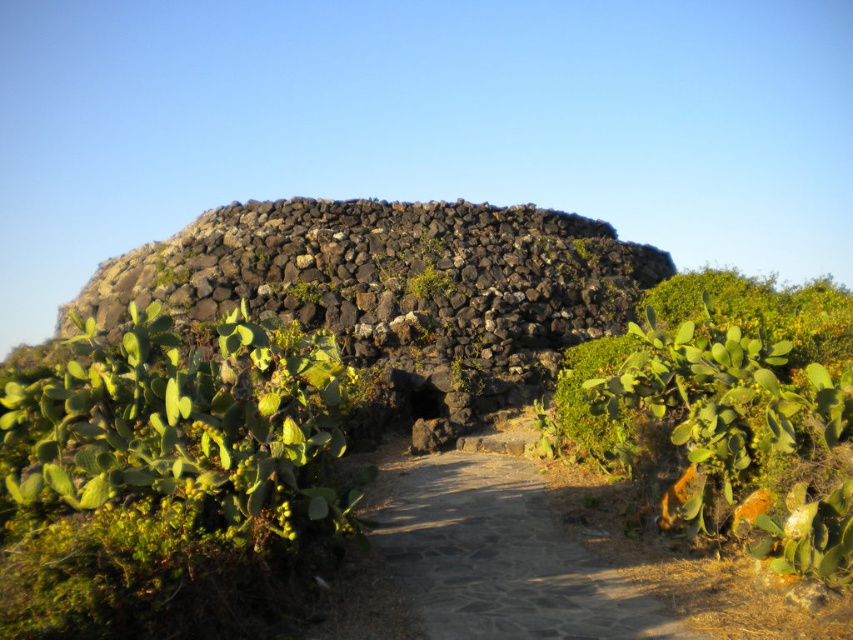
You are standing on the paved pathway leading to the ancient stone structure. You notice a volcanic rock at center and a green mossy plant at center. Which object is closer to you?

The volcanic rock at center is closer to the viewer than the green mossy plant at center.

You are a gardener planning to transplant the green succulent at lower left and the green mossy plant at center to a new garden bed. Which of the two plants requires more space due to its size?

The green succulent at lower left requires more space because it has a larger size compared to the green mossy plant at center.

You are a visitor approaching the stone structure and notice two plants near the entrance. Which plant, the green succulent at lower left or the green mossy plant at center, is closer to the ground?

The green succulent at lower left is closer to the ground as it is positioned below the green mossy plant at center.